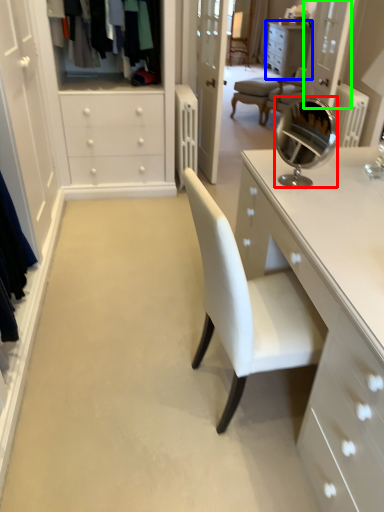
Question: Estimate the real-world distances between objects in this image. Which object is closer to mirror (highlighted by a red box), cabinetry (highlighted by a blue box) or glass door (highlighted by a green box)?

Choices:
 (A) cabinetry
 (B) glass door

Answer: (B)